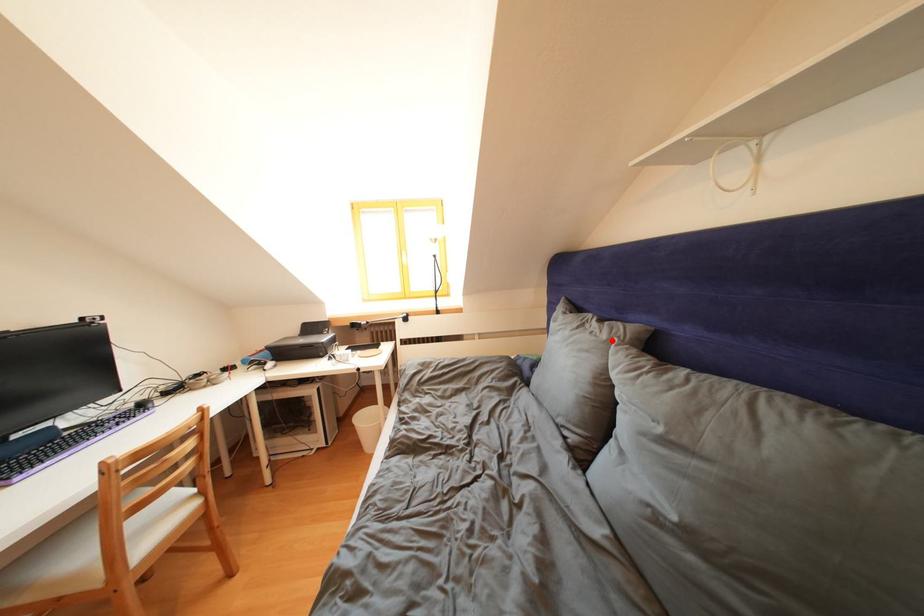
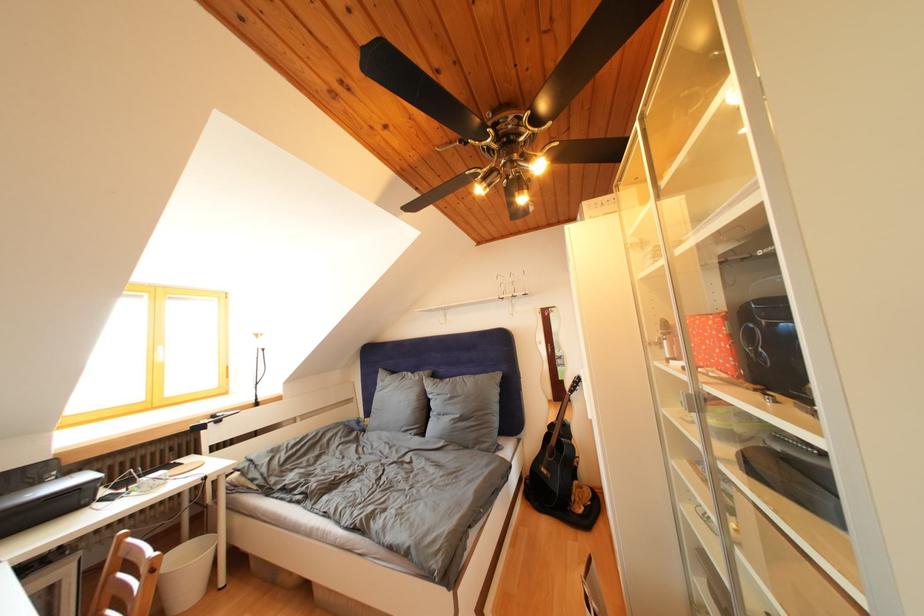
The point at the highlighted location is marked in the first image. Where is the corresponding point in the second image?

(426, 383)